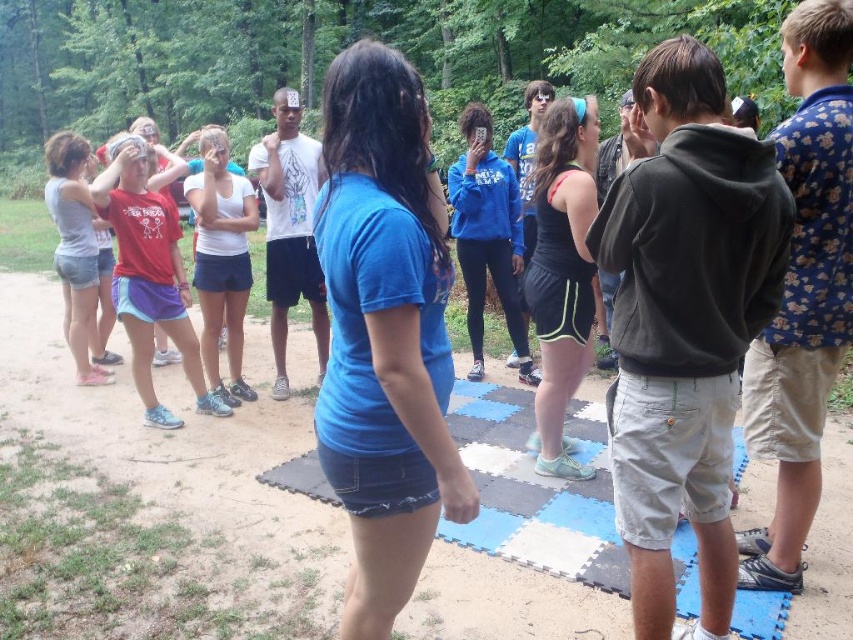
You are standing in the middle of the group and want to throw a frisbee to either the point at coordinates point [137,211] or point [239,401]. Which point is closer to you?

Point [137,211] is closer to the camera than point [239,401], so you should throw the frisbee to point [137,211] as it is closer to you.